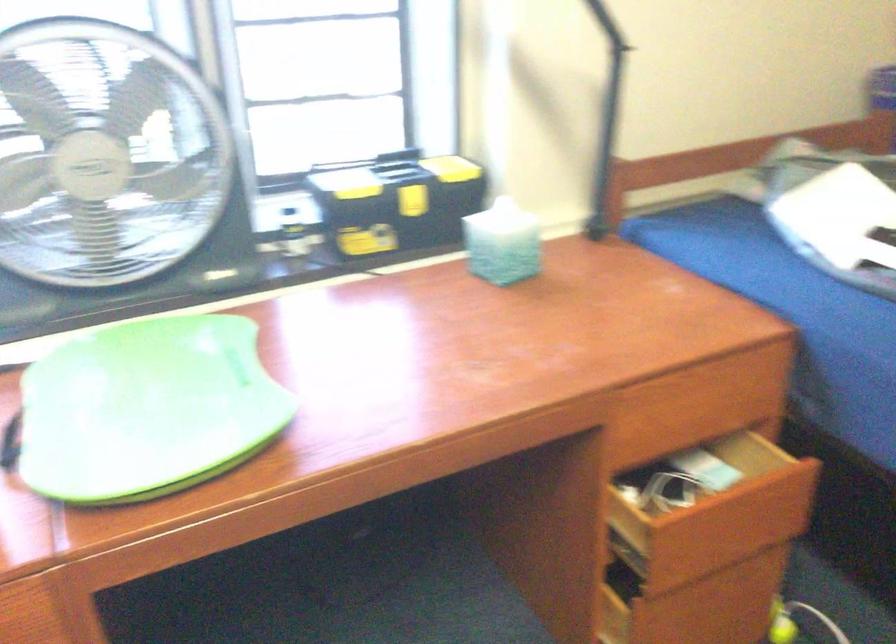
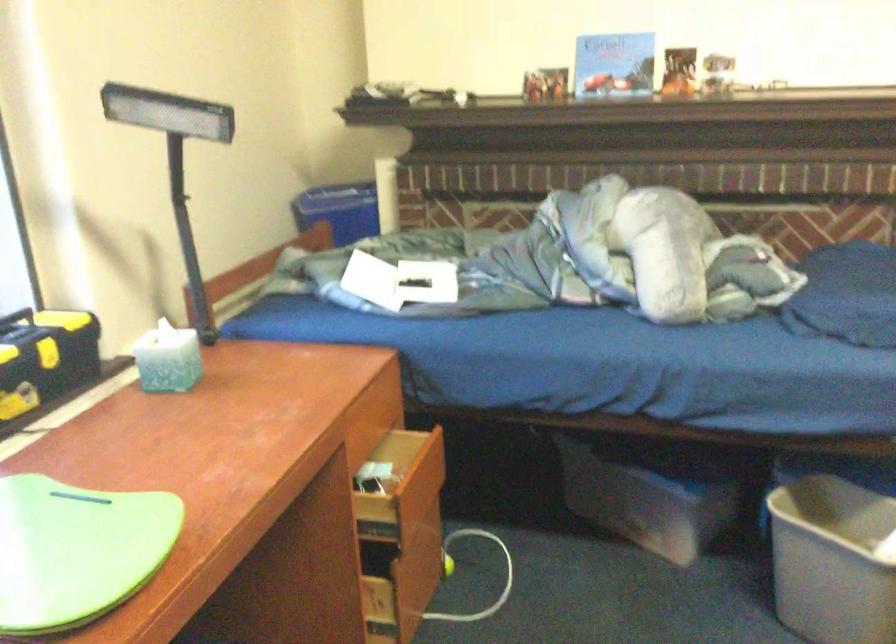
Locate, in the second image, the point that corresponds to point (403, 198) in the first image.

(46, 354)